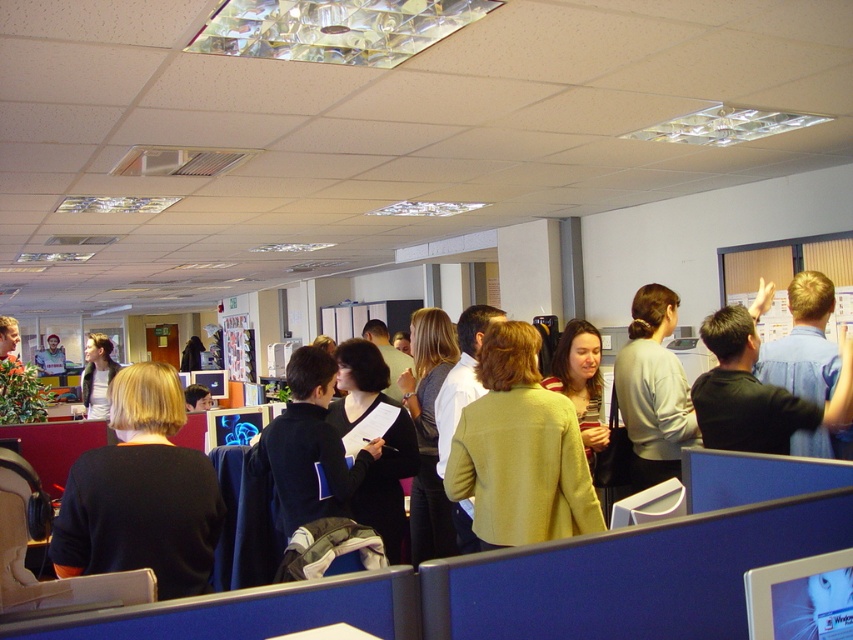
Question: From the image, what is the correct spatial relationship of light gray sweater at center in relation to light brown hair at center?

Choices:
 (A) left
 (B) right

Answer: (B)

Question: Which of the following is the farthest from the observer?

Choices:
 (A) (641, 401)
 (B) (96, 394)
 (C) (120, 484)

Answer: (B)

Question: Can you confirm if dark blue sweater at center is positioned above metallic silver bulletin board at center?

Choices:
 (A) no
 (B) yes

Answer: (A)

Question: Is dark blue sweater at center above blue denim shirt at upper right?

Choices:
 (A) yes
 (B) no

Answer: (B)

Question: Which point is farther to the camera?

Choices:
 (A) blue denim shirt at upper right
 (B) dark blue sweater at center

Answer: (A)

Question: Which object appears farthest from the camera in this image?

Choices:
 (A) dark blue sweater at center
 (B) light gray sweater at center
 (C) blue denim shirt at upper right
 (D) metallic silver bulletin board at center

Answer: (D)